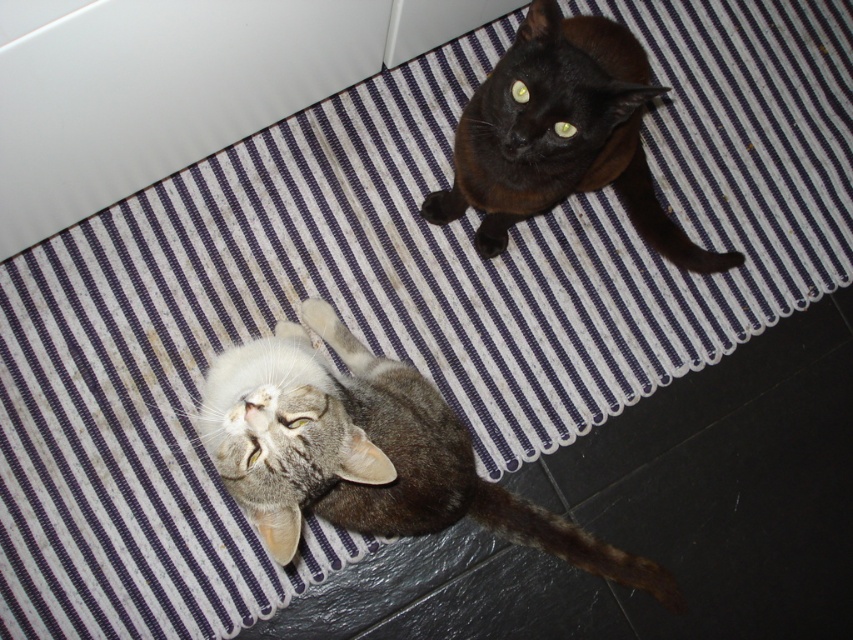
Can you confirm if gray tabby cat at lower left is taller than black glossy cat at upper center?

Yes, gray tabby cat at lower left is taller than black glossy cat at upper center.

Who is higher up, gray tabby cat at lower left or black glossy cat at upper center?

black glossy cat at upper center is above.

Is point (457, 518) more distant than point (527, 204)?

Yes, it is behind point (527, 204).

The width and height of the screenshot is (853, 640). I want to click on gray tabby cat at lower left, so click(x=367, y=452).